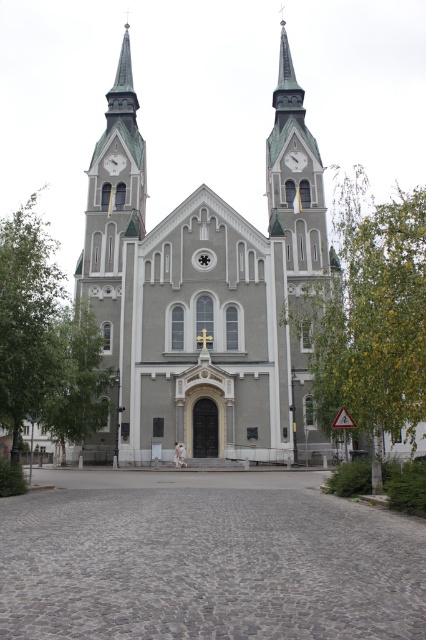
You are standing in front of the church and want to plant a new tree that needs to be exactly 170.82 feet away from the green leafy tree at center. Can you place it directly behind the church without crossing the tree?

The green leafy tree at center and viewer are 170.82 feet apart. If you want to plant a new tree exactly 170.82 feet away from the green leafy tree at center, placing it directly behind the church would require measuring the distance from the existing tree. Since the viewer is already 170.82 feet away from the tree, you could position the new tree an additional 170.82 feet behind the church, ensuring it is exactly that distance from the original tree without crossing it.

You are standing in front of the gray stone church at center and want to see the white glossy clock at upper center. Is the clock visible from your current position?

The gray stone church at center is in front of the white glossy clock at upper center, so the clock may be partially or fully obscured by the church. You might need to move to a different position to see it clearly.

Based on the photo, you are standing in front of the church and notice a green leafy tree at left and a green textured spire at center. Which one appears larger in size?

The green leafy tree at left is bigger than the green textured spire at center.